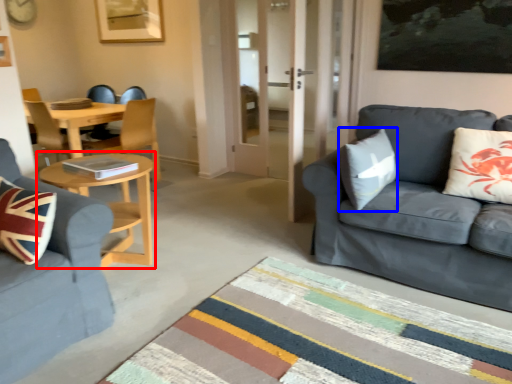
Question: Among these objects, which one is farthest to the camera, coffee table (highlighted by a red box) or pillow (highlighted by a blue box)?

Choices:
 (A) coffee table
 (B) pillow

Answer: (A)